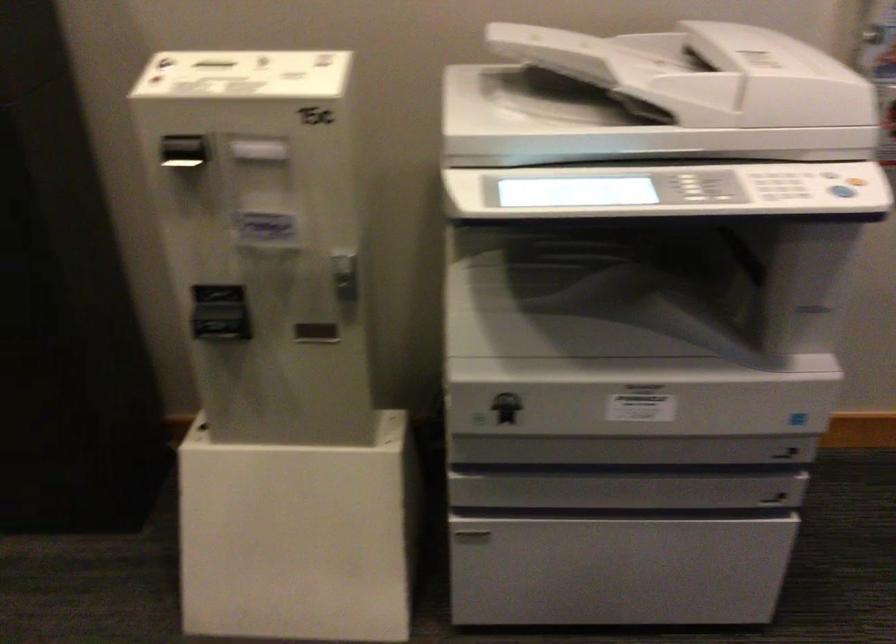
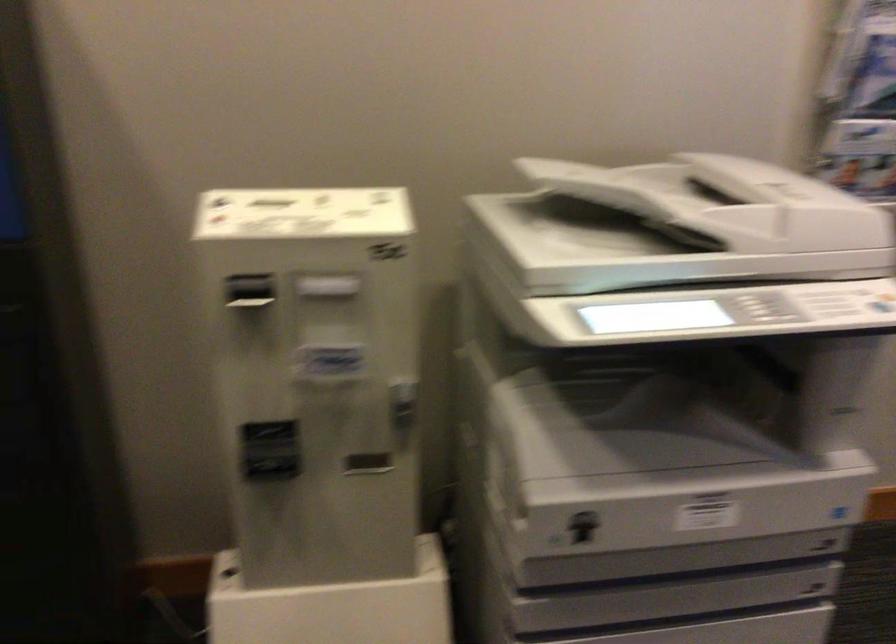
Question: What movement of the cameraman would produce the second image?

Choices:
 (A) Left
 (B) Right
 (C) Forward
 (D) Backward

Answer: (A)